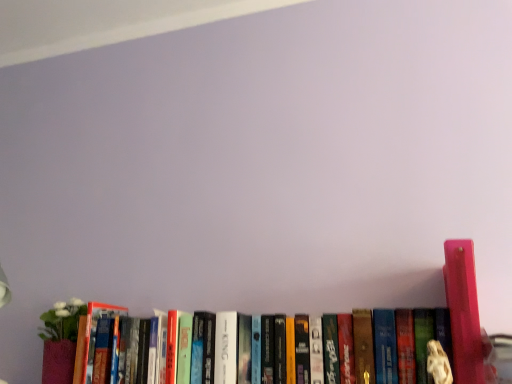
Question: Considering the positions of hardcover book at center, acting as the 2th book starting from the right, and pink plastic figurine at right, which ranks as the first book in right-to-left order, in the image, is hardcover book at center, acting as the 2th book starting from the right, wider or thinner than pink plastic figurine at right, which ranks as the first book in right-to-left order,?

Choices:
 (A) thin
 (B) wide

Answer: (A)

Question: Considering the positions of hardcover book at center, acting as the 2th book starting from the right, and pink plastic figurine at right, the 2th book from the left, in the image, is hardcover book at center, acting as the 2th book starting from the right, taller or shorter than pink plastic figurine at right, the 2th book from the left,?

Choices:
 (A) short
 (B) tall

Answer: (A)

Question: Considering their positions, is hardcover book at center, acting as the 2th book starting from the right, located in front of or behind pink plastic figurine at right, which ranks as the first book in right-to-left order?

Choices:
 (A) front
 (B) behind

Answer: (B)

Question: Based on their positions, is pink plastic figurine at right, which ranks as the first book in right-to-left order, located to the left or right of hardcover book at center, placed as the 1th book when sorted from left to right?

Choices:
 (A) left
 (B) right

Answer: (B)

Question: From the image's perspective, is pink plastic figurine at right, which ranks as the first book in right-to-left order, located above or below hardcover book at center, acting as the 2th book starting from the right?

Choices:
 (A) below
 (B) above

Answer: (B)

Question: Is pink plastic figurine at right, the 2th book from the left, taller or shorter than hardcover book at center, acting as the 2th book starting from the right?

Choices:
 (A) tall
 (B) short

Answer: (A)

Question: Based on their sizes in the image, would you say pink plastic figurine at right, the 2th book from the left, is bigger or smaller than hardcover book at center, acting as the 2th book starting from the right?

Choices:
 (A) small
 (B) big

Answer: (A)